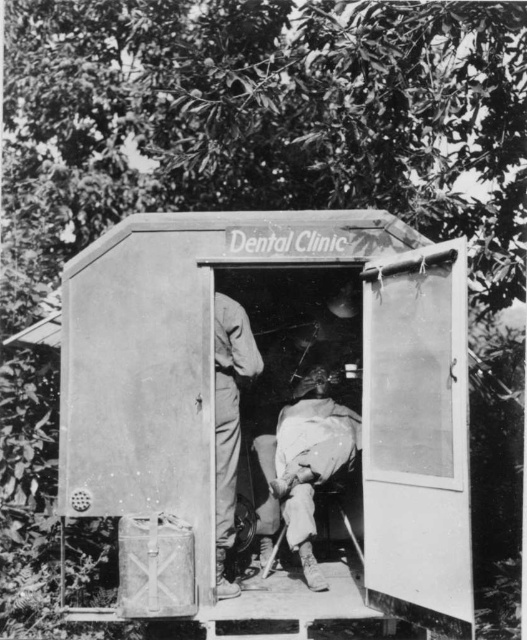
Question: Among these points, which one is farthest from the camera?

Choices:
 (A) (220, 529)
 (B) (294, 536)

Answer: (B)

Question: Where is metallic gray hut at center located in relation to white fabric cloth at center in the image?

Choices:
 (A) above
 (B) below

Answer: (A)

Question: Which object is farther from the camera taking this photo?

Choices:
 (A) white fabric cloth at center
 (B) metallic gray hut at center

Answer: (A)

Question: Can you confirm if metallic gray hut at center is smaller than matte khaki pants at center?

Choices:
 (A) yes
 (B) no

Answer: (B)

Question: Is the position of metallic gray hut at center less distant than that of white fabric cloth at center?

Choices:
 (A) yes
 (B) no

Answer: (A)

Question: Which point is farther from the camera taking this photo?

Choices:
 (A) (187, 268)
 (B) (229, 323)
 (C) (318, 392)

Answer: (C)